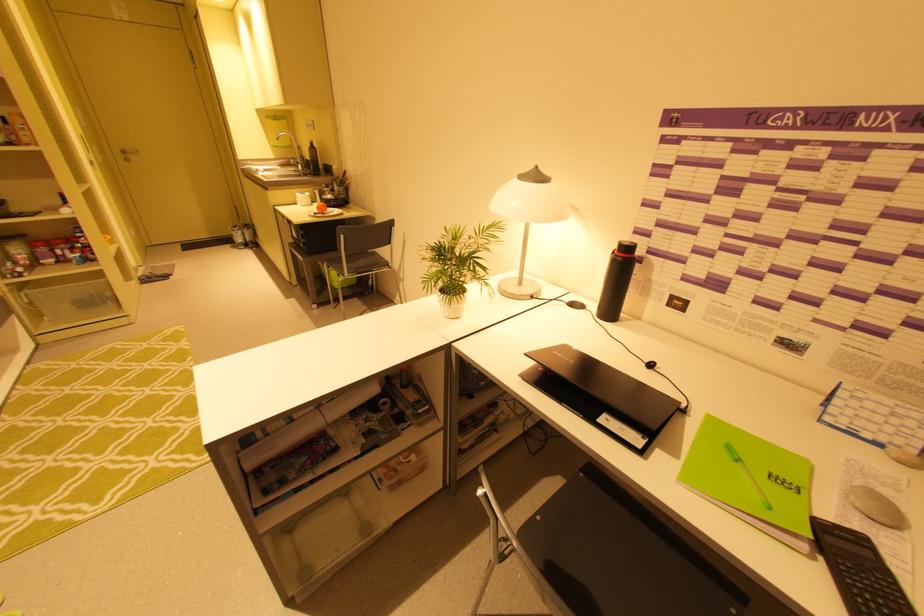
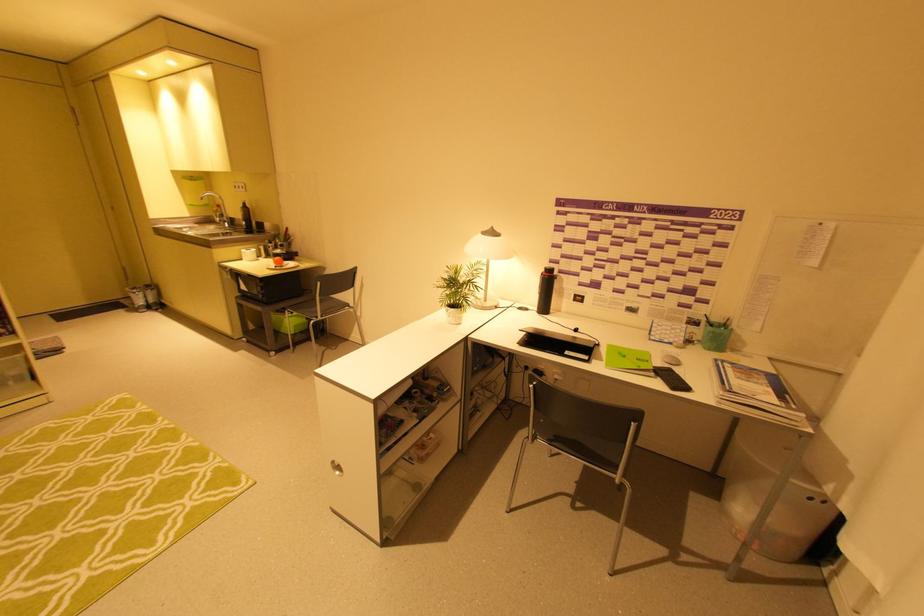
Where in the second image is the point corresponding to [334,265] from the first image?

(299, 310)